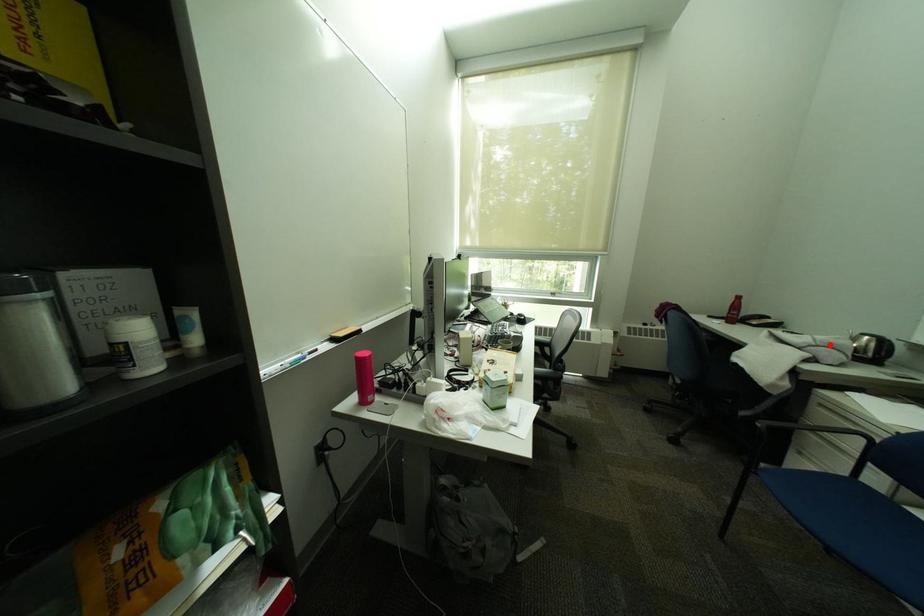
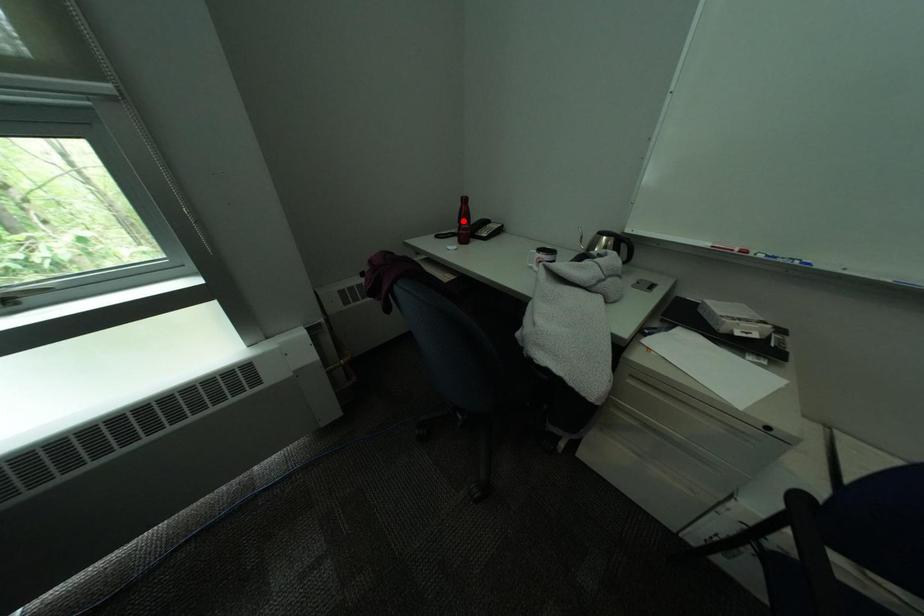
I am providing you with two images of the same scene from different viewpoints. A red point is marked on the first image and another point is marked on the second image. Do the highlighted points in image1 and image2 indicate the same real-world spot?

No